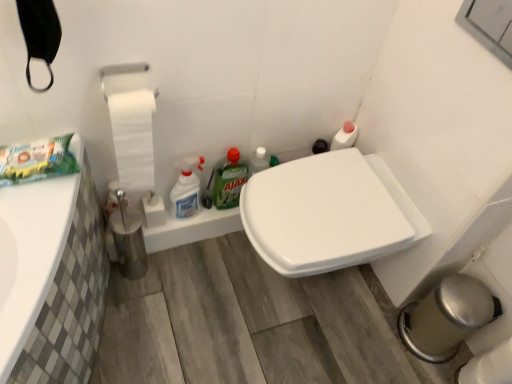
At what (x,y) coordinates should I click in order to perform the action: click on free space in front of white glossy toilet seat at center. Please return your answer as a coordinate pair (x, y). Looking at the image, I should click on (286, 355).